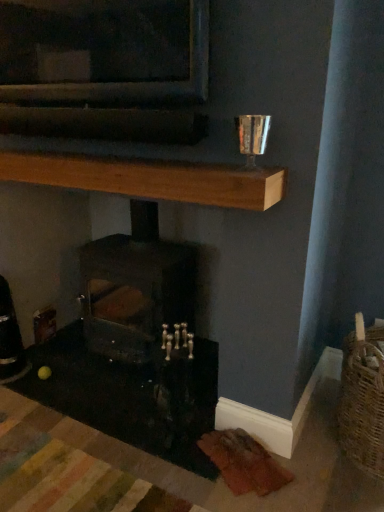
Question: Which direction should I rotate to look at dark gray stone wood burning stove at center?

Choices:
 (A) right
 (B) left

Answer: (B)

Question: Is wooden plank at upper center surrounding dark gray stone wood burning stove at center?

Choices:
 (A) yes
 (B) no

Answer: (B)

Question: Is wooden plank at upper center positioned with its back to dark gray stone wood burning stove at center?

Choices:
 (A) yes
 (B) no

Answer: (B)

Question: Is wooden plank at upper center positioned beyond the bounds of dark gray stone wood burning stove at center?

Choices:
 (A) yes
 (B) no

Answer: (A)

Question: Is wooden plank at upper center aimed at dark gray stone wood burning stove at center?

Choices:
 (A) no
 (B) yes

Answer: (A)

Question: Can you confirm if wooden plank at upper center is smaller than dark gray stone wood burning stove at center?

Choices:
 (A) yes
 (B) no

Answer: (A)

Question: Can you confirm if wooden plank at upper center is taller than dark gray stone wood burning stove at center?

Choices:
 (A) no
 (B) yes

Answer: (A)

Question: Can you see dark gray stone wood burning stove at center touching wooden plank at upper center?

Choices:
 (A) yes
 (B) no

Answer: (B)

Question: Is dark gray stone wood burning stove at center not within wooden plank at upper center?

Choices:
 (A) no
 (B) yes

Answer: (B)

Question: Is dark gray stone wood burning stove at center far away from wooden plank at upper center?

Choices:
 (A) no
 (B) yes

Answer: (A)

Question: Does dark gray stone wood burning stove at center lie in front of wooden plank at upper center?

Choices:
 (A) yes
 (B) no

Answer: (B)

Question: From a real-world perspective, is dark gray stone wood burning stove at center physically above wooden plank at upper center?

Choices:
 (A) no
 (B) yes

Answer: (A)

Question: Does dark gray stone wood burning stove at center have a larger size compared to wooden plank at upper center?

Choices:
 (A) yes
 (B) no

Answer: (A)

Question: Is point (6, 161) positioned closer to the camera than point (97, 329)?

Choices:
 (A) farther
 (B) closer

Answer: (B)